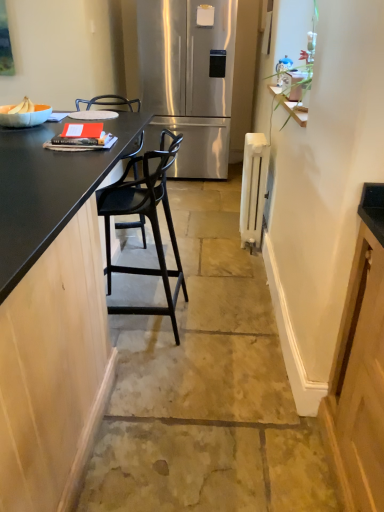
Question: From the image's perspective, relative to black matte bar stool at center, is white painted metal radiator at right above or below?

Choices:
 (A) above
 (B) below

Answer: (A)

Question: Is white painted metal radiator at right situated inside black matte bar stool at center or outside?

Choices:
 (A) inside
 (B) outside

Answer: (B)

Question: Based on their relative distances, which object is nearer to the matte black barstool at center?

Choices:
 (A) black matte bar stool at center
 (B) white painted metal radiator at right
 (C) stainless steel refrigerator at center
 (D) black matte countertop at left

Answer: (A)

Question: Based on their relative distances, which object is nearer to the stainless steel refrigerator at center?

Choices:
 (A) black matte countertop at left
 (B) white painted metal radiator at right
 (C) black matte bar stool at center
 (D) matte black barstool at center

Answer: (B)